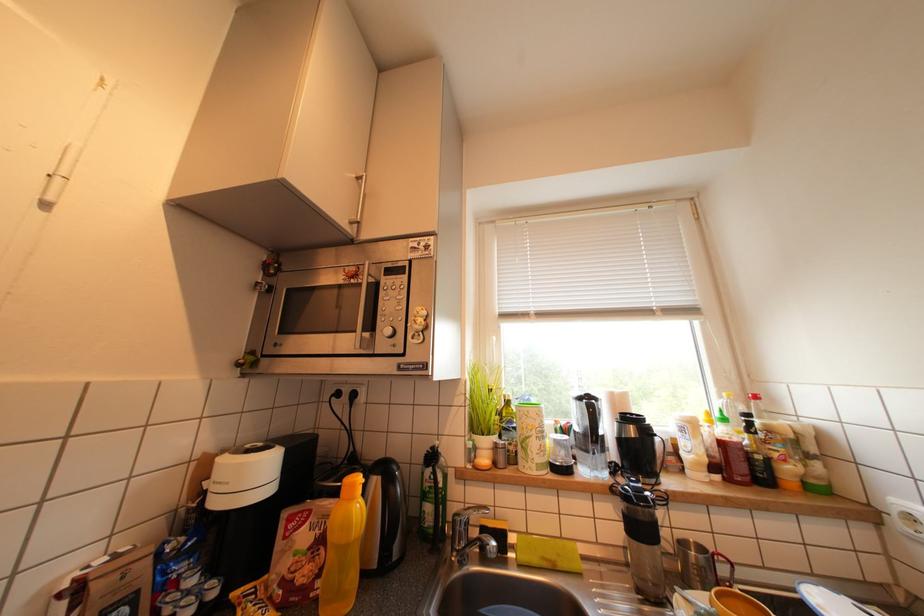
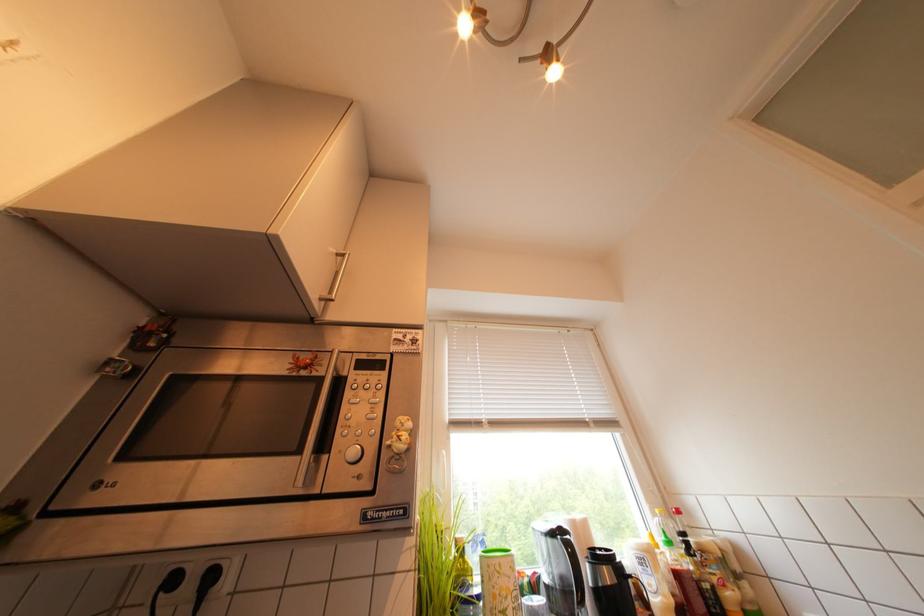
The first image is from the beginning of the video and the second image is from the end. How did the camera likely rotate when shooting the video?

The rotation direction of the camera is right-up.